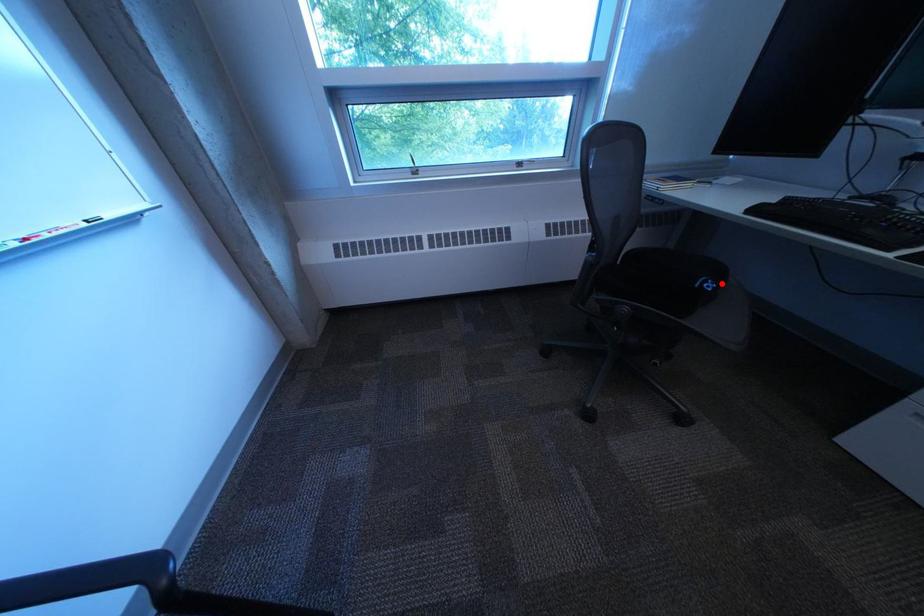
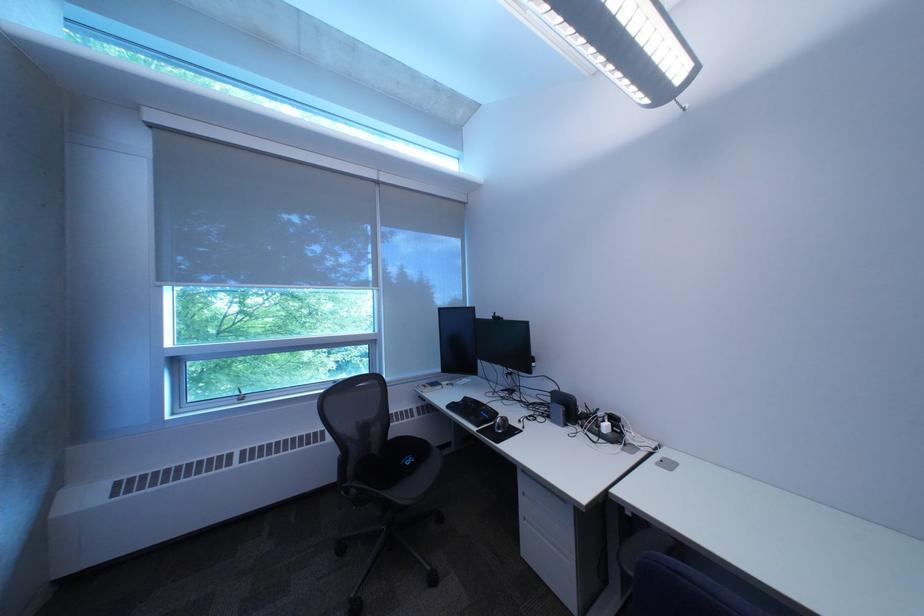
Where in the second image is the point corresponding to the highlighted location from the first image?

(423, 461)